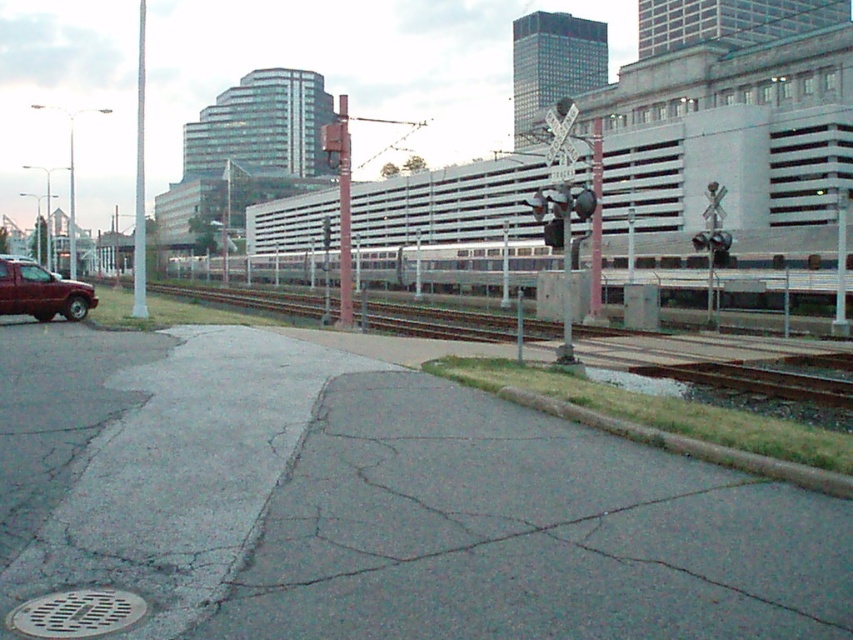
Who is positioned more to the left, white glossy pole at center or metallic pole at center?

Positioned to the left is white glossy pole at center.

Who is shorter, white glossy pole at center or metallic pole at center?

metallic pole at center

Does point (141, 33) come behind point (595, 234)?

Yes, point (141, 33) is farther from viewer.

Locate an element on the screen. The image size is (853, 640). white glossy pole at center is located at coordinates [138, 179].

Does point (35, 288) come in front of point (341, 314)?

Yes, it is in front of point (341, 314).

Does matte red truck at left lie in front of metallic gray pole at center?

Yes, it is in front of metallic gray pole at center.

Does point (9, 273) lie behind point (328, 145)?

That is False.

Find the location of a particular element. This screenshot has height=640, width=853. matte red truck at left is located at coordinates (41, 292).

Find the location of a particular element. The width and height of the screenshot is (853, 640). metallic gray pole at center is located at coordinates (343, 209).

Who is positioned more to the left, metallic gray pole at center or metallic pole at center?

metallic gray pole at center

Between point (341, 129) and point (596, 232), which one is positioned in front?

Point (341, 129)

The height and width of the screenshot is (640, 853). I want to click on metallic gray pole at center, so 343,209.